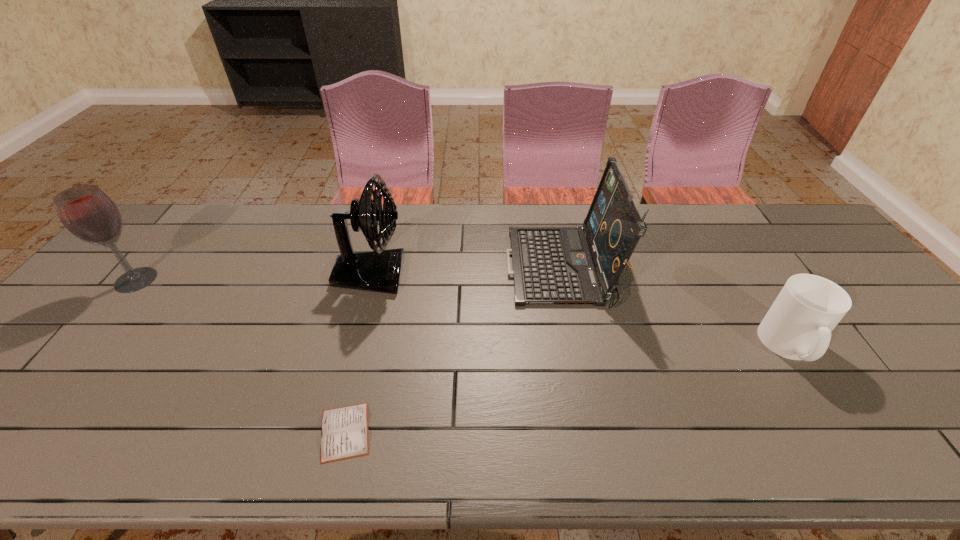
What are the coordinates of `free space located on the front-facing side of the fourth object from left to right` in the screenshot? It's located at (487, 269).

Locate an element on the screen. The image size is (960, 540). free spot located 0.190m on the back of the alcohol is located at coordinates (179, 228).

At what (x,y) coordinates should I click in order to perform the action: click on vacant space located 0.150m on the handle side of the fourth farthest object. Please return your answer as a coordinate pair (x, y). Image resolution: width=960 pixels, height=540 pixels. Looking at the image, I should click on (848, 436).

Image resolution: width=960 pixels, height=540 pixels. Identify the location of blank area located on the back of the diary. (362, 362).

I want to click on object that is positioned at the far edge, so pyautogui.click(x=551, y=265).

The image size is (960, 540). What are the coordinates of `object that is at the near edge` in the screenshot? It's located at (344, 430).

Identify the location of object present at the left edge. The height and width of the screenshot is (540, 960). (88, 213).

Identify the location of vacant area at the far edge. (690, 207).

Locate an element on the screen. vacant region at the near edge is located at coordinates (420, 444).

You are a GUI agent. You are given a task and a screenshot of the screen. Output one action in this format:
    pyautogui.click(x=<x>, y=<y>)
    Task: Click on the vacant region at the left edge of the desktop
    The width and height of the screenshot is (960, 540).
    Given the screenshot: What is the action you would take?
    pyautogui.click(x=79, y=312)